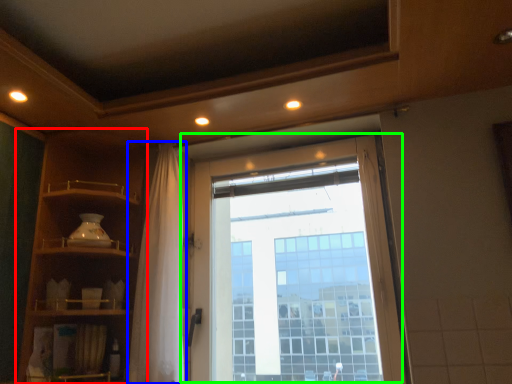
Question: Which is farther away from shelf (highlighted by a red box)? shower curtain (highlighted by a blue box) or window (highlighted by a green box)?

Choices:
 (A) shower curtain
 (B) window

Answer: (B)